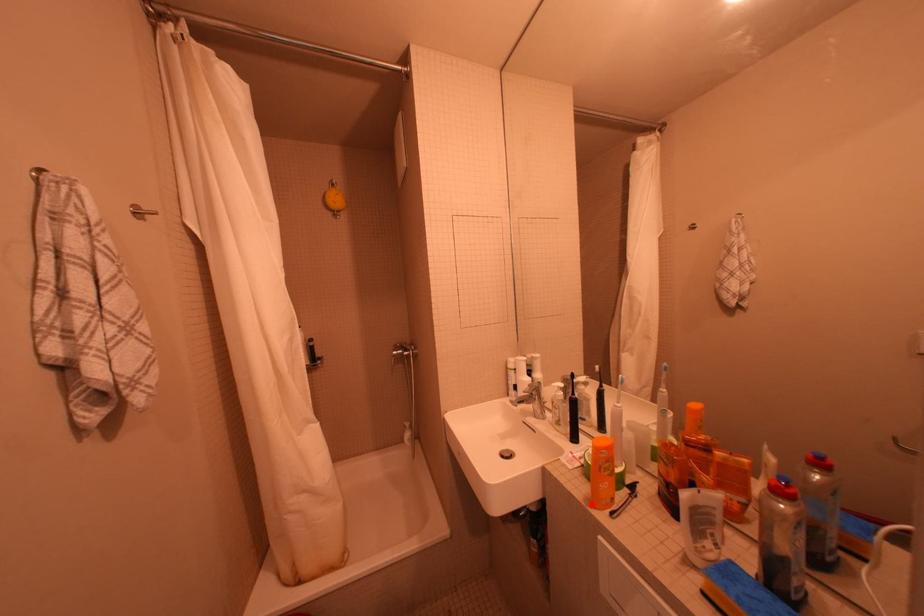
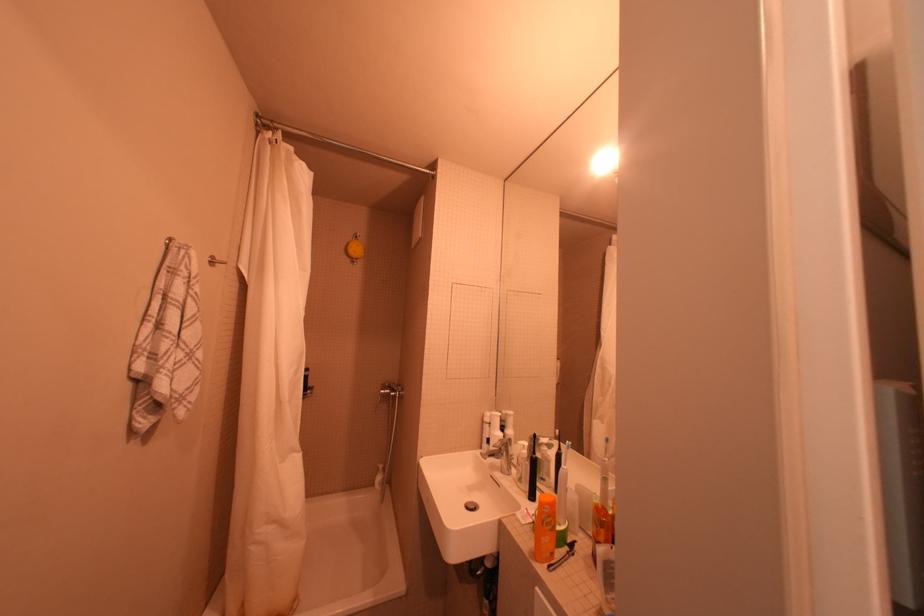
The point at the highlighted location is marked in the first image. Where is the corresponding point in the second image?

(536, 557)